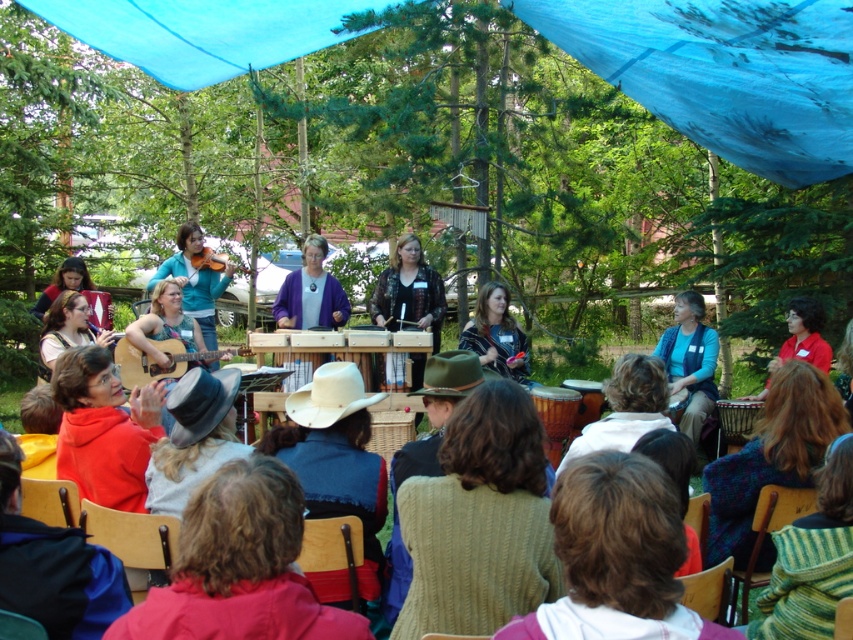
Is matte brown jacket at center bigger than matte black flute at left?

No, matte brown jacket at center is not bigger than matte black flute at left.

Between matte brown jacket at center and matte black flute at left, which one appears on the left side from the viewer's perspective?

matte black flute at left

Locate an element on the screen. This screenshot has height=640, width=853. matte brown jacket at center is located at coordinates (496, 333).

Find the location of a particular element. matte brown jacket at center is located at coordinates (496, 333).

Is knitted beige sweater at center shorter than matte red sweater at lower left?

No.

Consider the image. Measure the distance between knitted beige sweater at center and camera.

The distance of knitted beige sweater at center from camera is 2.85 meters.

Identify the location of knitted beige sweater at center. (479, 520).

Does red sweater at lower left come in front of wooden chair at lower center?

Yes, red sweater at lower left is closer to the viewer.

Which is behind, point (57, 561) or point (354, 576)?

Point (354, 576)

Identify the location of red sweater at lower left. The image size is (853, 640). (53, 564).